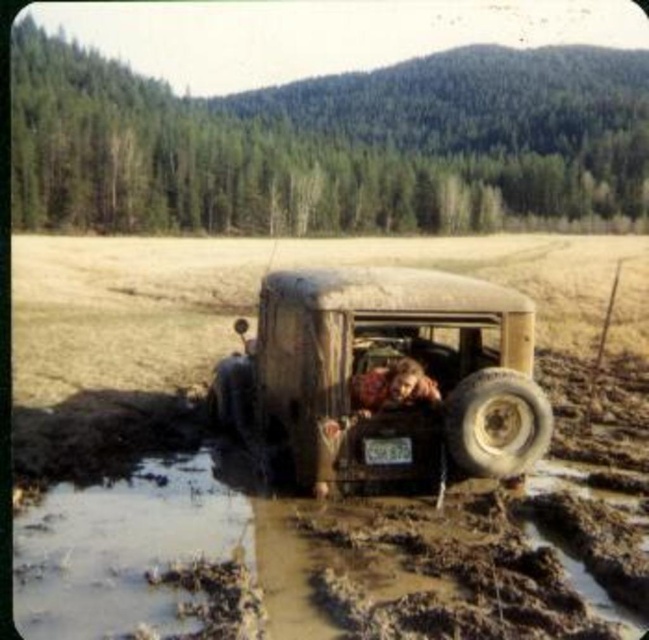
You are a mechanic trying to assess the situation. You see the light brown rubber tire at lower right and the brown leather jacket at rear center. Which object is taller?

The light brown rubber tire at lower right has a greater height compared to the brown leather jacket at rear center, so the light brown rubber tire at lower right is taller.

You are a mechanic trying to tow the muddy rubber truck at center using a tow rope attached to the light brown rubber tire at lower right. Given that the tow rope can only handle a maximum load difference of 100 kg between the two objects, can you safely proceed with the tow?

The muddy rubber truck at center is wider than the light brown rubber tire at lower right, but the question of weight difference isn not addressed in the provided information. Therefore, it is impossible to determine if the tow rope can safely handle the load based on the given details.